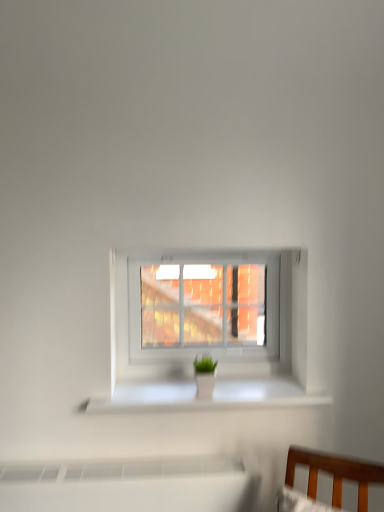
Question: Considering the positions of white glossy planter at center and white plastic window at center in the image, is white glossy planter at center wider or thinner than white plastic window at center?

Choices:
 (A) thin
 (B) wide

Answer: (B)

Question: From their relative heights in the image, would you say white glossy planter at center is taller or shorter than white plastic window at center?

Choices:
 (A) tall
 (B) short

Answer: (B)

Question: Would you say white glossy planter at center is to the left or to the right of white plastic window at center in the picture?

Choices:
 (A) right
 (B) left

Answer: (B)

Question: Would you say white plastic window at center is to the left or to the right of white glossy planter at center in the picture?

Choices:
 (A) right
 (B) left

Answer: (A)

Question: Is white plastic window at center spatially inside white glossy planter at center, or outside of it?

Choices:
 (A) outside
 (B) inside

Answer: (A)

Question: Is white plastic window at center in front of or behind white glossy planter at center in the image?

Choices:
 (A) behind
 (B) front

Answer: (A)

Question: Considering the positions of point (119, 296) and point (223, 394), is point (119, 296) closer or farther from the camera than point (223, 394)?

Choices:
 (A) closer
 (B) farther

Answer: (A)